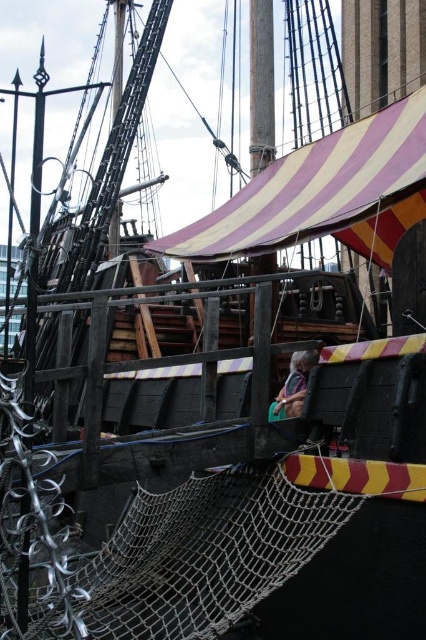
Looking at this image, you are standing on the deck of the wooden ship and want to place a new item between the striped canvas canopy at upper center and the green fabric bag at center. Based on their positions, which object should be placed to the right side of the new item?

The striped canvas canopy at upper center is to the left of green fabric bag at center, so the new item should be placed between them with the striped canvas canopy at upper center on the left side and the green fabric bag at center on the right side.

You are standing on the deck of the ship and need to locate the striped canvas canopy at upper center. According to the coordinates provided, what are the exact coordinates where you should look to find it?

The striped canvas canopy at upper center is located at the coordinates point (313,186).